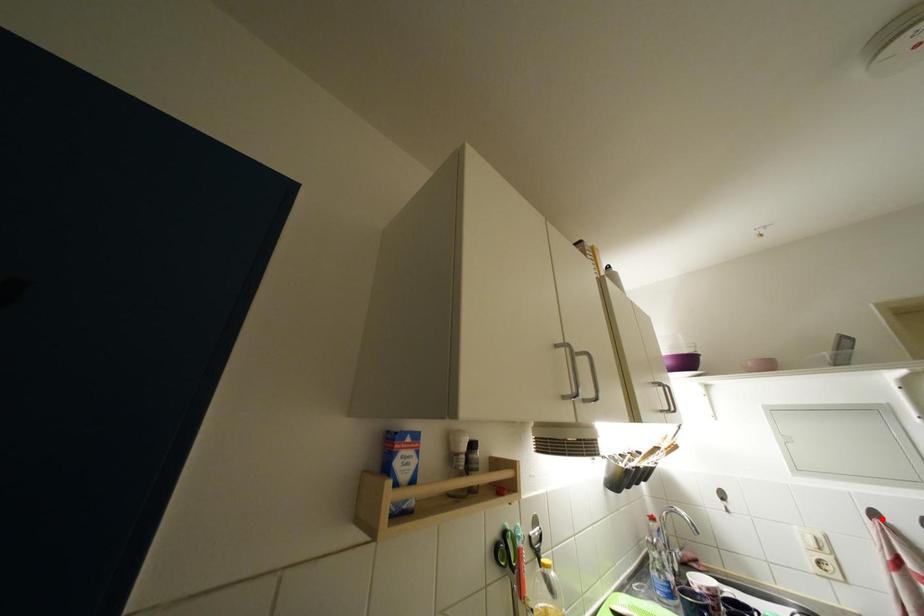
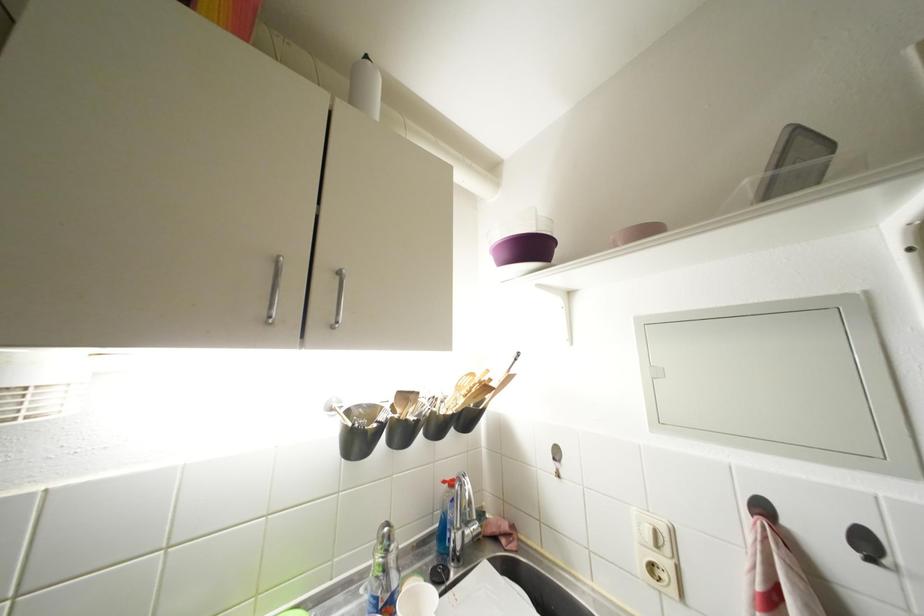
In the second image, find the point that corresponds to the highlighted location in the first image.

(770, 513)